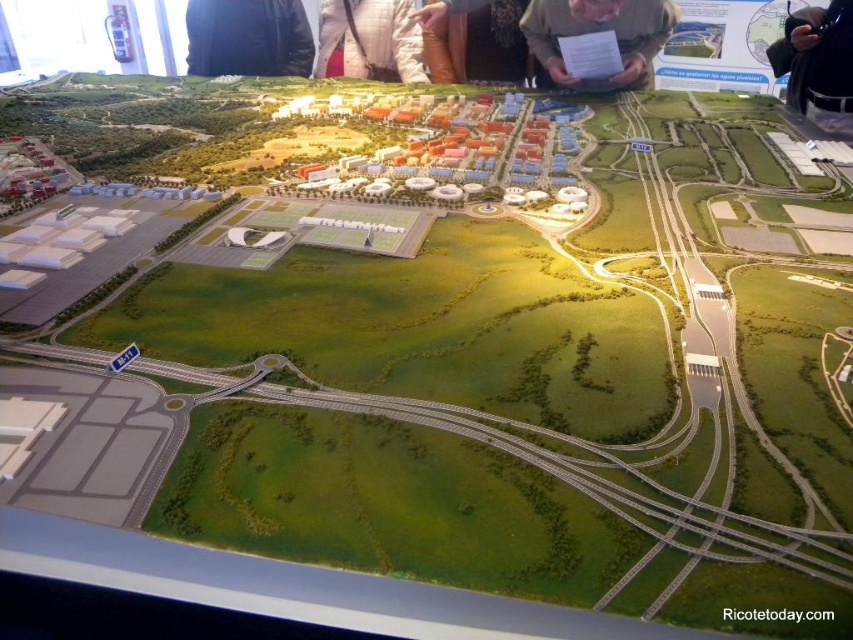
Looking at this image, you are a visitor at the exhibition and want to see both the matte brown paper at upper center and the black leather jacket at upper right clearly. However, you are currently standing at a position where you can only see one of them. Which object is blocking your view of the other?

The matte brown paper at upper center is blocking the view of the black leather jacket at upper right because the black leather jacket at upper right is behind matte brown paper at upper center.

You are a city planner reviewing the miniature model of the urban development project. You need to place a new green park marker on the model. The existing park area is represented by the matte brown paper at upper center. Where exactly should you place the new marker to align with the current park location?

The new green park marker should be placed at point coordinates [599,32] where the matte brown paper at upper center is located.